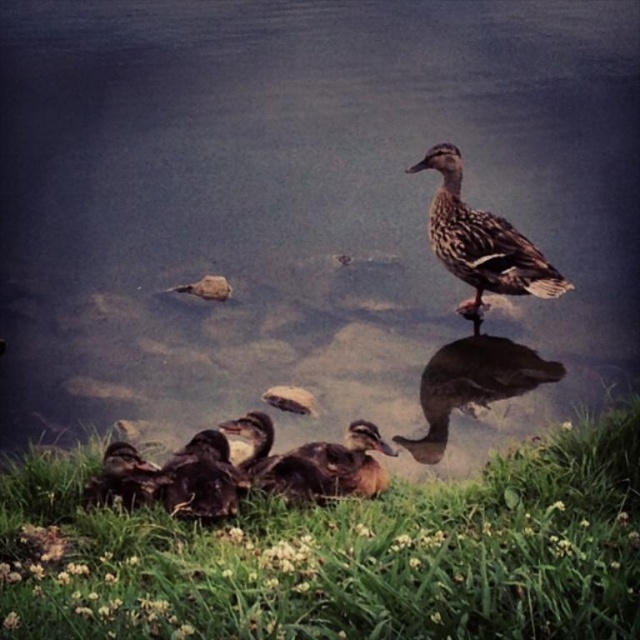
Question: Can you confirm if brown fuzzy duckling at center is smaller than brown fuzzy duckling at lower left?

Choices:
 (A) no
 (B) yes

Answer: (A)

Question: Which point is farther to the camera?

Choices:
 (A) (147, 464)
 (B) (285, 612)

Answer: (A)

Question: Which is nearer to the brown feathered duck at center?

Choices:
 (A) green grass at lower center
 (B) brown fuzzy duckling at lower left
 (C) brown fuzzy ducklings at lower center

Answer: (A)

Question: Is green grass at lower center wider than brown fuzzy duckling at center?

Choices:
 (A) no
 (B) yes

Answer: (B)

Question: Is green grass at lower center wider than brown fuzzy duckling at lower left?

Choices:
 (A) no
 (B) yes

Answer: (B)

Question: Which object is positioned closest to the brown fuzzy duckling at lower left?

Choices:
 (A) brown feathered duck at center
 (B) brown speckled duck at upper right
 (C) green grass at lower center
 (D) brown fuzzy ducklings at lower center

Answer: (D)